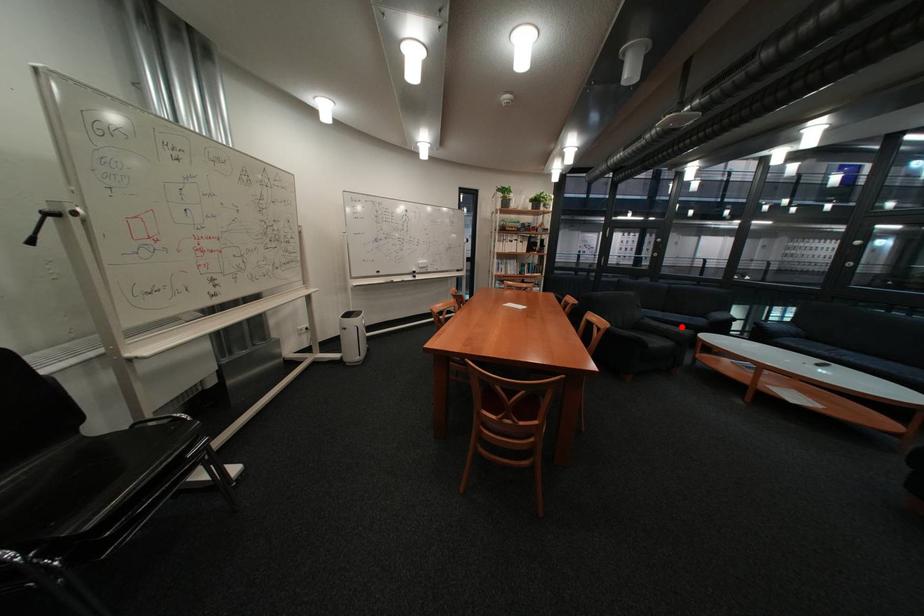
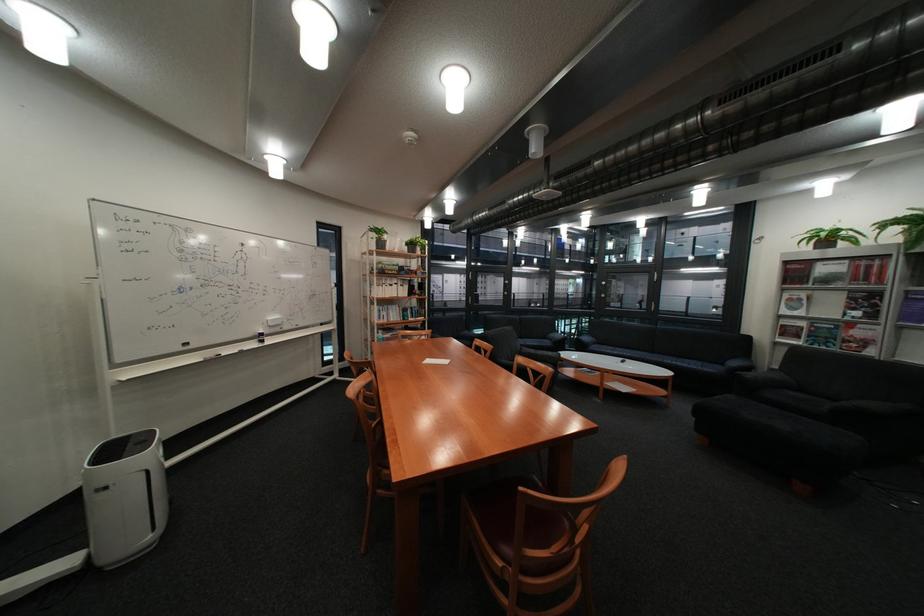
Question: A red point is marked in image1. In image2, is the corresponding 3D point closer to the camera or farther? Reply with the corresponding letter.

Choices:
 (A) The corresponding 3D point is closer.
 (B) The corresponding 3D point is farther.

Answer: (A)